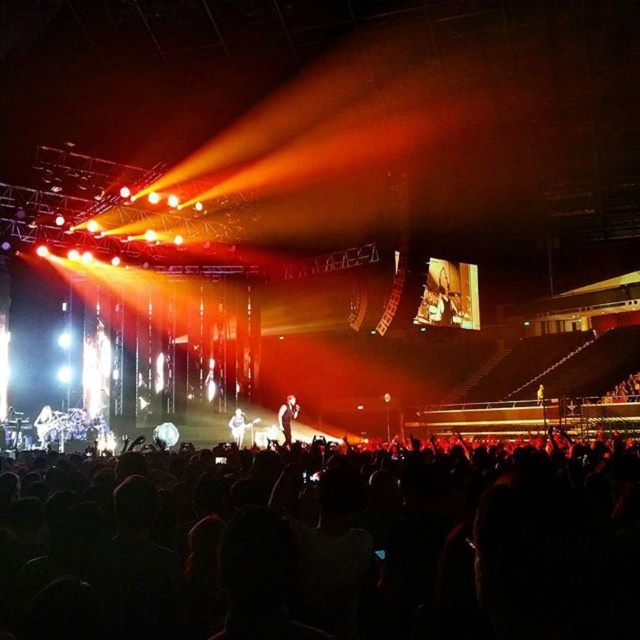
You are a photographer at the concert and want to capture a photo of the white fabric shirt at center without the black matte crowd at lower center appearing in the frame. Based on their positions, is this possible?

The black matte crowd at lower center is to the right of the white fabric shirt at center, so if you position yourself to the right side of the white fabric shirt at center and angle the camera away from the right direction, you can avoid including the black matte crowd at lower center in the photo.

You are standing at the point marked by the coordinates point (x=323, y=547) in the concert venue. Looking around, you notice the black matte crowd at lower center. Which direction should you face to see the performers on stage?

The black matte crowd at lower center is represented by point (x=323, y=547). To see the performers on stage, you should face away from the crowd towards the stage area.